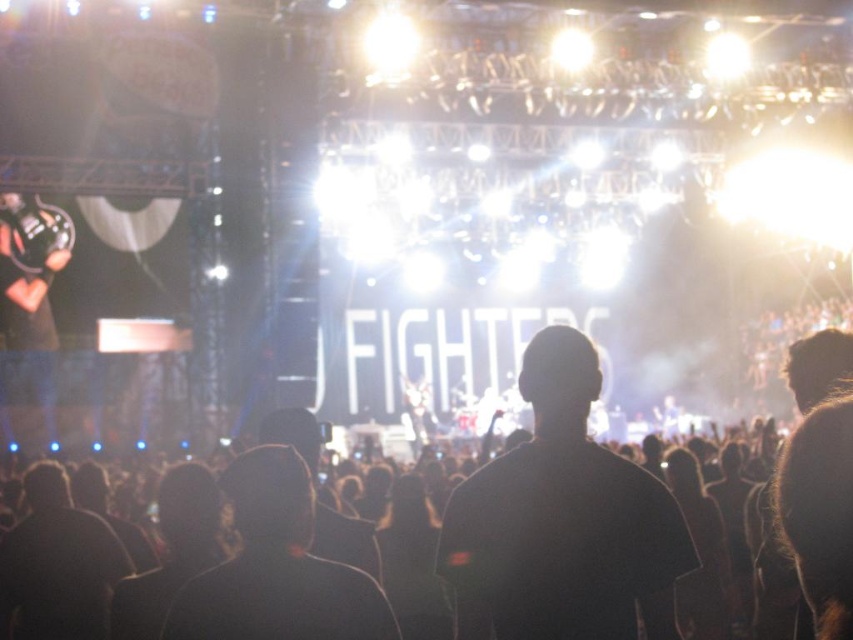
Question: Does black matte shirt at center have a lesser width compared to black matte jacket at center?

Choices:
 (A) yes
 (B) no

Answer: (B)

Question: Which object appears closest to the camera in this image?

Choices:
 (A) black matte jacket at center
 (B) black matte headband at center

Answer: (A)

Question: Which of these objects is positioned farthest from the black matte shirt at center?

Choices:
 (A) black matte jacket at center
 (B) black matte headband at center

Answer: (A)

Question: Can you confirm if black matte shirt at center is smaller than black matte headband at center?

Choices:
 (A) yes
 (B) no

Answer: (B)

Question: Which is farther from the black matte jacket at center?

Choices:
 (A) black matte shirt at center
 (B) black matte headband at center

Answer: (A)

Question: Does black matte shirt at center have a smaller size compared to black matte headband at center?

Choices:
 (A) yes
 (B) no

Answer: (B)